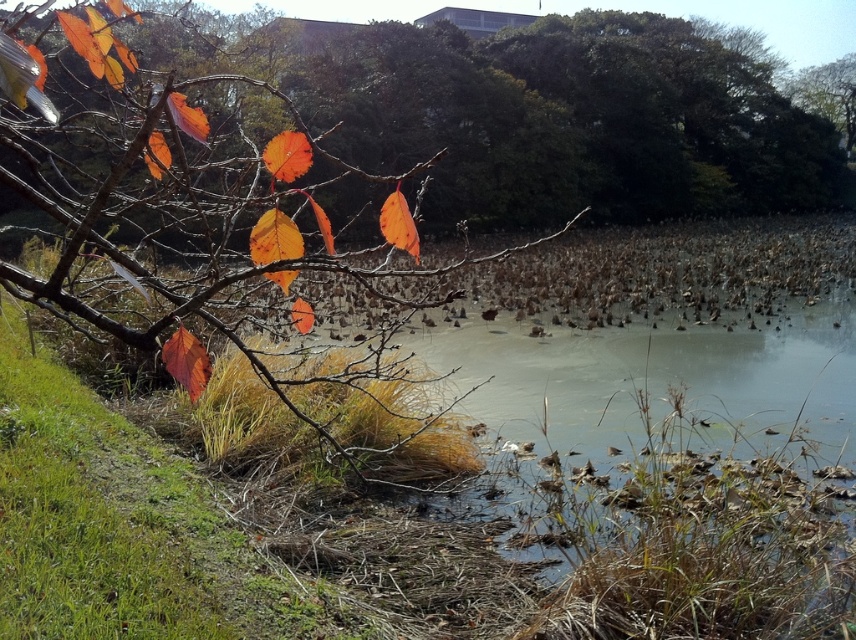
Does point (129, 148) come in front of point (774, 88)?

That is True.

Between matte orange leaves at left and orange matte leaves at upper left, which one has less height?

matte orange leaves at left

Image resolution: width=856 pixels, height=640 pixels. What are the coordinates of `matte orange leaves at left` in the screenshot? It's located at (192, 209).

What are the coordinates of `matte orange leaves at left` in the screenshot? It's located at 192,209.